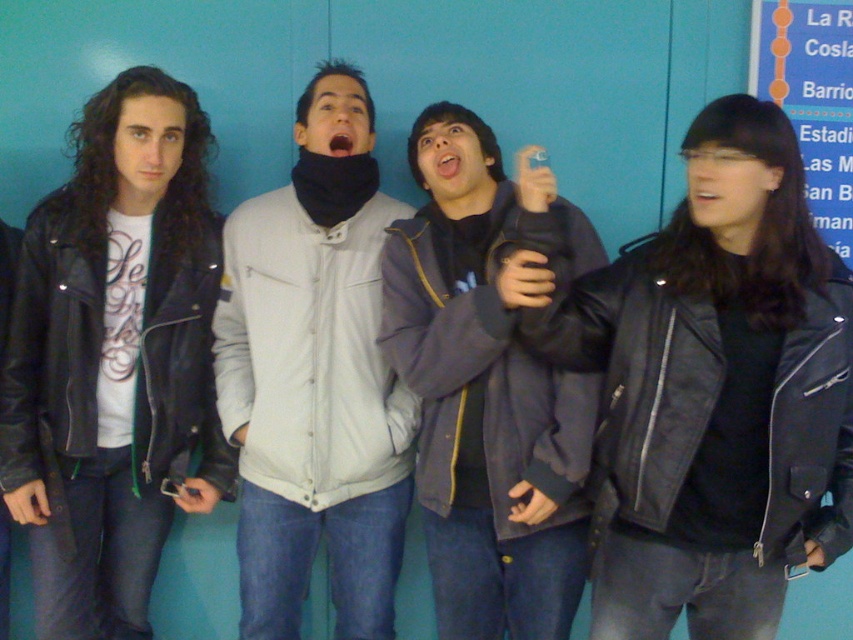
Question: Which object appears closest to the camera in this image?

Choices:
 (A) blue paper at upper right
 (B) matte black leather jacket at left
 (C) dark blue leather jacket at center
 (D) light gray fabric jacket at center

Answer: (C)

Question: Estimate the real-world distances between objects in this image. Which object is farther from the matte black leather jacket at left?

Choices:
 (A) black leather jacket at right
 (B) blue paper at upper right
 (C) dark blue leather jacket at center
 (D) light gray fabric jacket at center

Answer: (B)

Question: Observing the image, what is the correct spatial positioning of black leather jacket at right in reference to blue paper at upper right?

Choices:
 (A) right
 (B) left

Answer: (B)

Question: Can you confirm if black leather jacket at right is positioned to the left of matte black leather jacket at left?

Choices:
 (A) yes
 (B) no

Answer: (B)

Question: Which object is closer to the camera taking this photo?

Choices:
 (A) blue paper at upper right
 (B) dark blue leather jacket at center

Answer: (B)

Question: Is matte black leather jacket at left closer to the viewer compared to blue paper at upper right?

Choices:
 (A) no
 (B) yes

Answer: (B)